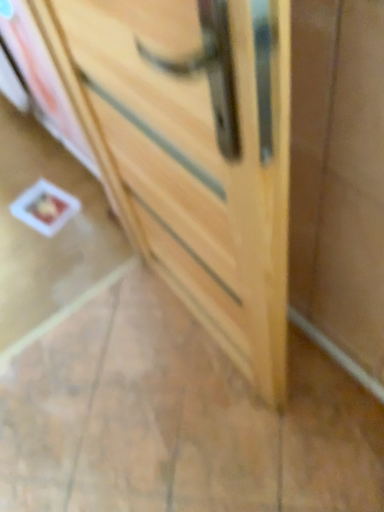
Measure the distance between wooden cabinet at lower left and camera.

wooden cabinet at lower left is 5.28 feet away from camera.

What do you see at coordinates (44, 234) in the screenshot?
I see `wooden cabinet at lower left` at bounding box center [44, 234].

Image resolution: width=384 pixels, height=512 pixels. In order to click on wooden cabinet at lower left in this screenshot , I will do `click(44, 234)`.

At what (x,y) coordinates should I click in order to perform the action: click on wooden cabinet at lower left. Please return your answer as a coordinate pair (x, y). Looking at the image, I should click on [x=44, y=234].